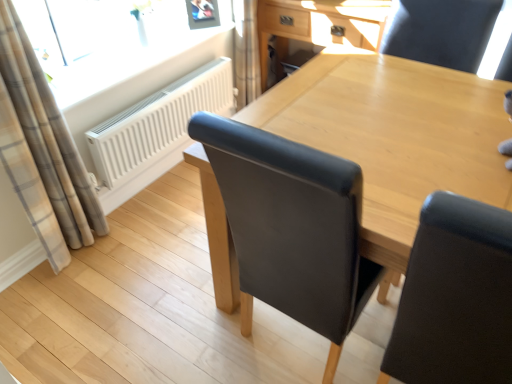
At what (x,y) coordinates should I click in order to perform the action: click on free space above light brown wood table at center (from a real-world perspective). Please return your answer as a coordinate pair (x, y). Image resolution: width=512 pixels, height=384 pixels. Looking at the image, I should click on pos(375,146).